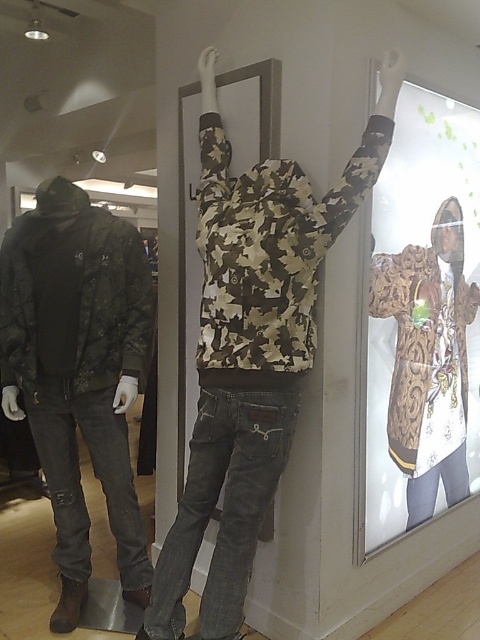
Question: Is camo-patterned sweatshirt at center below gold metallic jacket at upper right?

Choices:
 (A) no
 (B) yes

Answer: (B)

Question: Is camo-patterned sweatshirt at center smaller than camouflage fabric jacket at left?

Choices:
 (A) yes
 (B) no

Answer: (B)

Question: Which of the following is the closest to the observer?

Choices:
 (A) [x=54, y=205]
 (B) [x=442, y=460]

Answer: (A)

Question: Which point appears closest to the camera in this image?

Choices:
 (A) (156, 621)
 (B) (104, 262)
 (C) (405, 394)

Answer: (A)

Question: Does camo-patterned sweatshirt at center appear over camouflage fabric jacket at left?

Choices:
 (A) no
 (B) yes

Answer: (B)

Question: Which of the following is the closest to the observer?

Choices:
 (A) camouflage fabric jacket at left
 (B) gold metallic jacket at upper right
 (C) camo-patterned sweatshirt at center

Answer: (C)